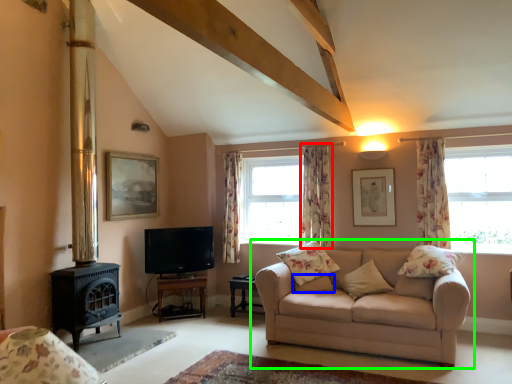
Question: Which object is the farthest from curtain (highlighted by a red box)? Choose among these: pillow (highlighted by a blue box) or studio couch (highlighted by a green box).

Choices:
 (A) pillow
 (B) studio couch

Answer: (B)